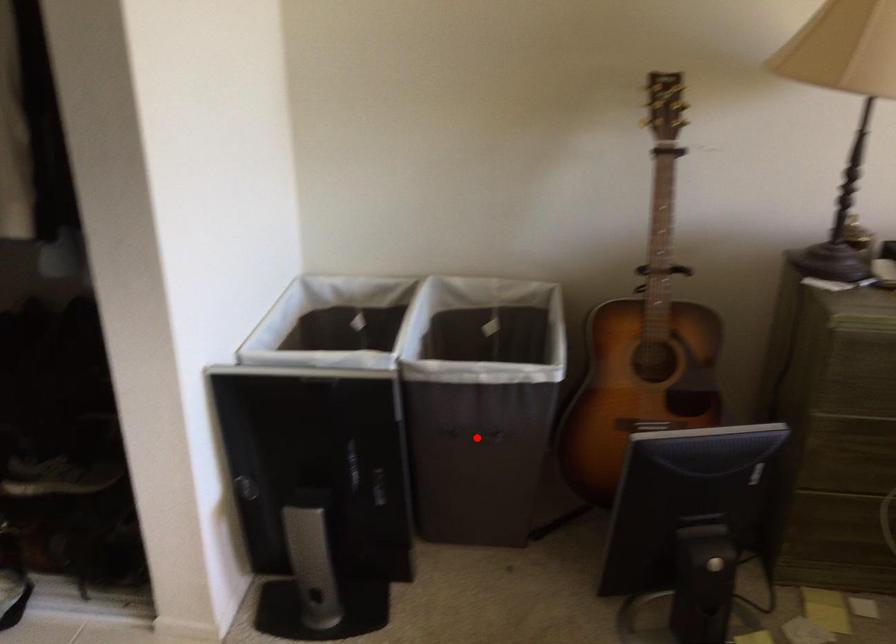
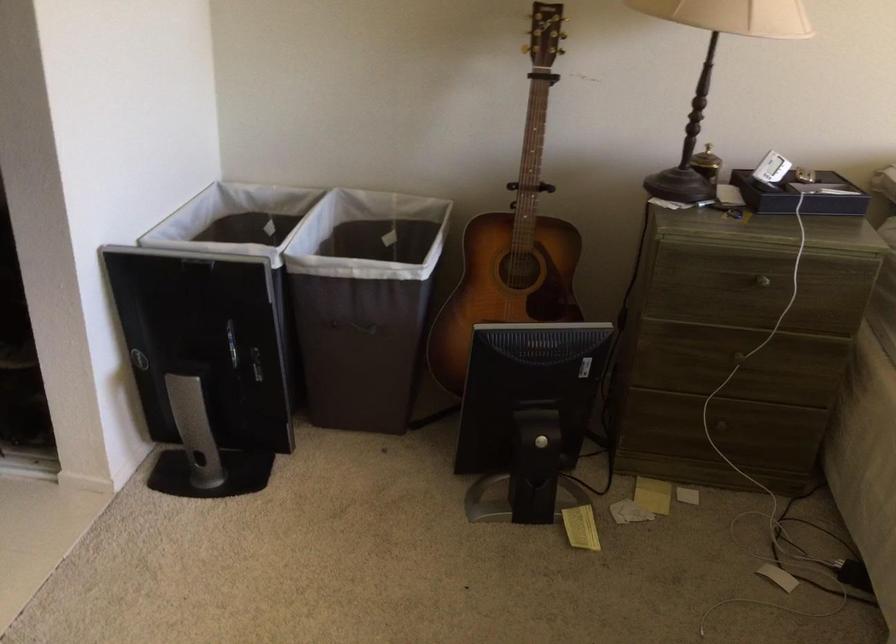
Question: A red point is marked in image1. In image2, is the corresponding 3D point closer to the camera or farther? Reply with the corresponding letter.

Choices:
 (A) The corresponding 3D point is closer.
 (B) The corresponding 3D point is farther.

Answer: (B)